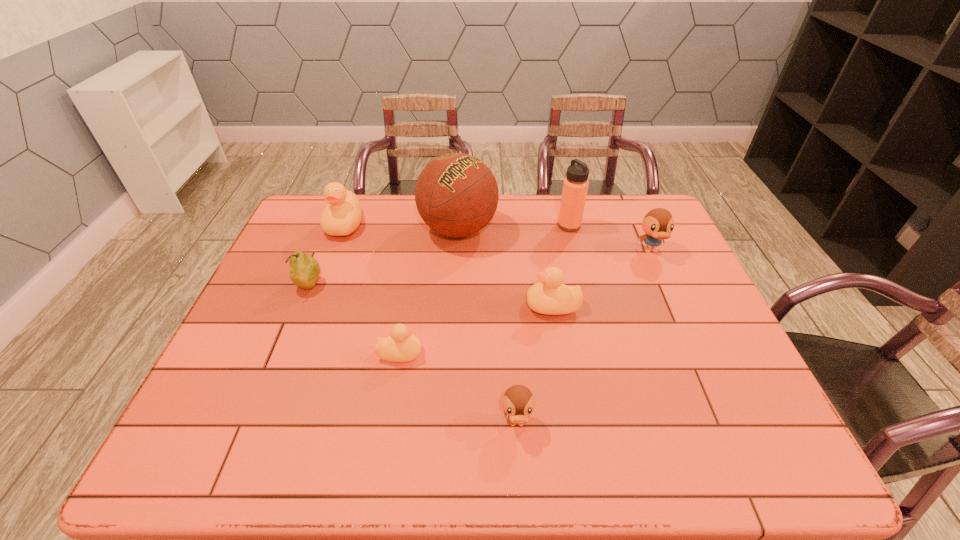
Where is `vacant space located on the right of the pear`? The width and height of the screenshot is (960, 540). vacant space located on the right of the pear is located at coordinates (375, 285).

Where is `free point located 0.050m on the front-facing side of the nearer blue duck`? free point located 0.050m on the front-facing side of the nearer blue duck is located at coordinates point(519,466).

Find the location of a particular element. free space located 0.190m on the face of the nearest yellow duck is located at coordinates (499, 353).

Locate an element on the screen. basketball present at the far edge is located at coordinates click(456, 194).

At what (x,y) coordinates should I click in order to perform the action: click on thermos bottle located at the far edge. Please return your answer as a coordinate pair (x, y). The width and height of the screenshot is (960, 540). Looking at the image, I should click on (575, 186).

You are a GUI agent. You are given a task and a screenshot of the screen. Output one action in this format:
    pyautogui.click(x=<x>, y=<y>)
    Task: Click on the duck that is at the far edge
    The width and height of the screenshot is (960, 540).
    Given the screenshot: What is the action you would take?
    pyautogui.click(x=342, y=216)

You are a GUI agent. You are given a task and a screenshot of the screen. Output one action in this format:
    pyautogui.click(x=<x>, y=<y>)
    Task: Click on the object that is at the near edge
    Image resolution: width=960 pixels, height=540 pixels.
    Given the screenshot: What is the action you would take?
    pyautogui.click(x=518, y=402)

Locate an element on the screen. This screenshot has width=960, height=540. duck positioned at the left edge is located at coordinates (342, 216).

I want to click on pear at the left edge, so click(x=304, y=272).

This screenshot has height=540, width=960. Find the location of `object that is at the right edge`. object that is at the right edge is located at coordinates (658, 224).